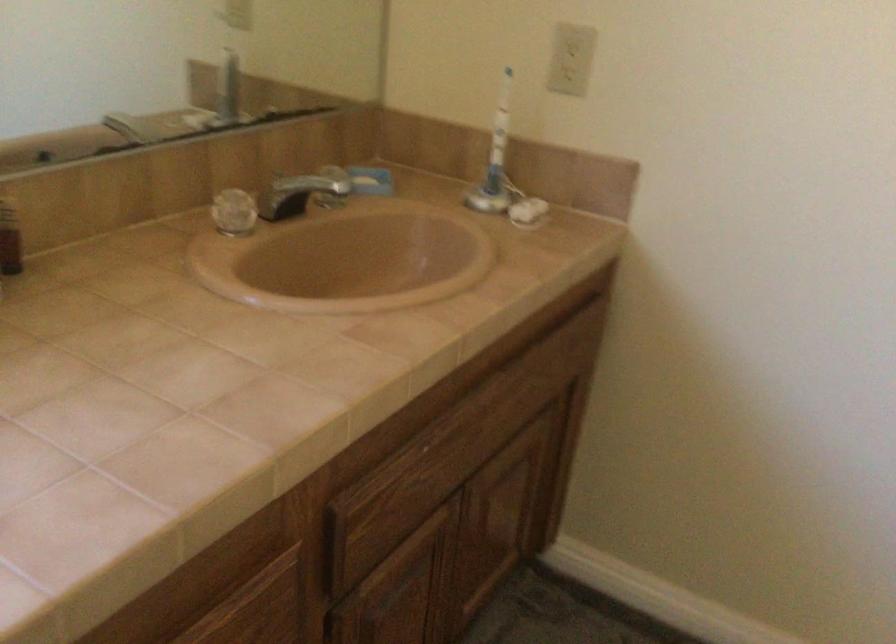
Consider the image. Based on the continuous images, in which direction is the camera rotating?

The camera rotated toward right-down.